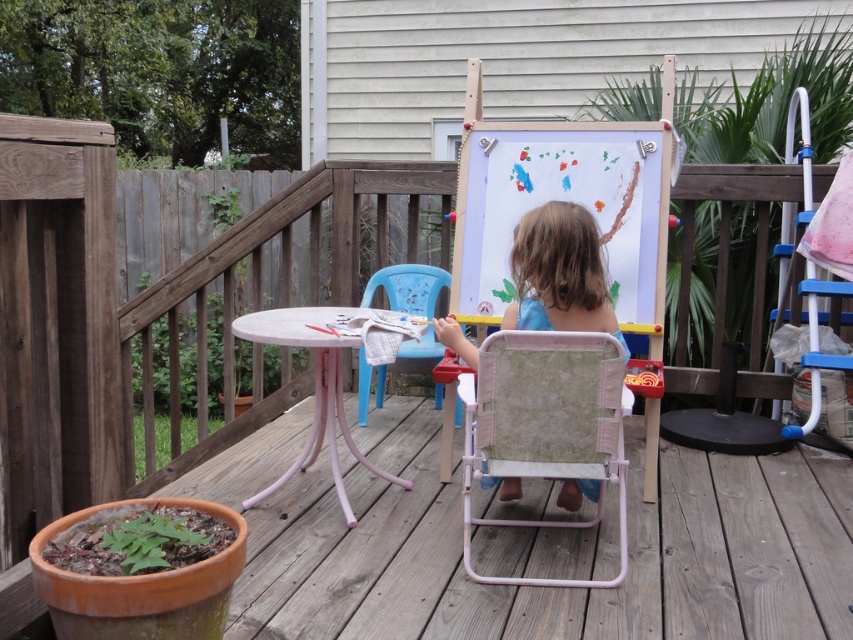
Is pink fabric chair at center thinner than blue plastic chair at center?

No.

Does pink fabric chair at center appear over blue plastic chair at center?

No.

What do you see at coordinates (546, 426) in the screenshot? The width and height of the screenshot is (853, 640). I see `pink fabric chair at center` at bounding box center [546, 426].

This screenshot has height=640, width=853. I want to click on pink fabric chair at center, so click(x=546, y=426).

Which is above, blue cotton shirt at center or blue plastic chair at center?

blue cotton shirt at center

Which is in front, point (579, 499) or point (422, 298)?

Point (579, 499) is in front.

Image resolution: width=853 pixels, height=640 pixels. In order to click on blue cotton shirt at center in this screenshot , I will do `click(560, 273)`.

You are a GUI agent. You are given a task and a screenshot of the screen. Output one action in this format:
    pyautogui.click(x=<x>, y=<y>)
    Task: Click on the blue cotton shirt at center
    This screenshot has height=640, width=853.
    Given the screenshot: What is the action you would take?
    pyautogui.click(x=560, y=273)

Is pink fabric chair at center wider than blue cotton shirt at center?

Incorrect, pink fabric chair at center's width does not surpass blue cotton shirt at center's.

Is pink fabric chair at center smaller than blue cotton shirt at center?

No, pink fabric chair at center is not smaller than blue cotton shirt at center.

Is point (468, 509) closer to camera compared to point (561, 289)?

That is False.

Image resolution: width=853 pixels, height=640 pixels. I want to click on pink fabric chair at center, so click(x=546, y=426).